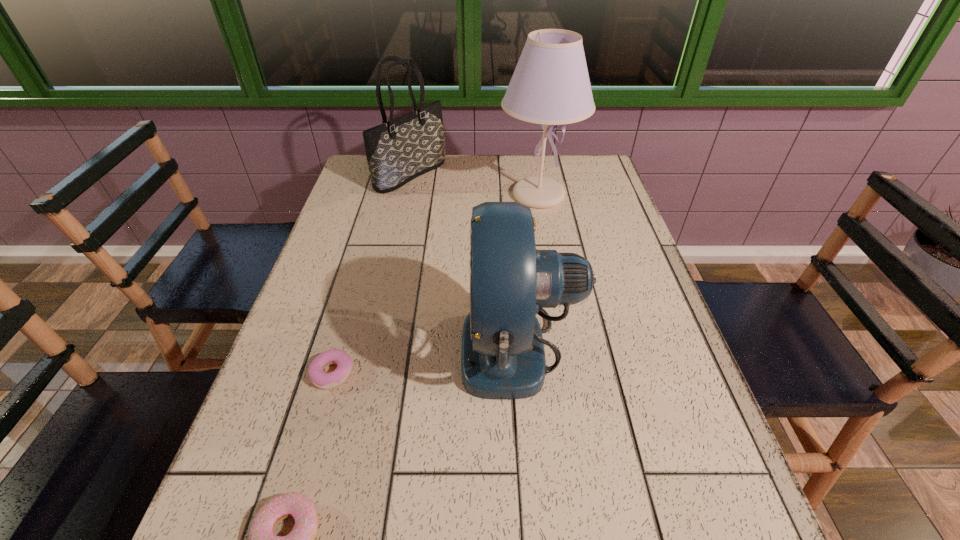
The image size is (960, 540). In order to click on the tallest object in this screenshot , I will do `click(550, 86)`.

The image size is (960, 540). Identify the location of tote bag. (399, 150).

Locate an element on the screen. This screenshot has width=960, height=540. fan is located at coordinates (502, 353).

Identify the location of pastry. The width and height of the screenshot is (960, 540). coord(321,379).

Find the location of a particular element. Image resolution: width=960 pixels, height=540 pixels. vacant space located on the left of the lampshade is located at coordinates (429, 195).

The image size is (960, 540). I want to click on vacant area situated on the right of the tote bag, so click(483, 176).

Locate an element on the screen. Image resolution: width=960 pixels, height=540 pixels. free space located in front of the fan to blow air is located at coordinates click(375, 346).

The width and height of the screenshot is (960, 540). I want to click on free space located in front of the fan to blow air, so click(x=357, y=346).

Locate an element on the screen. This screenshot has width=960, height=540. free space located 0.290m in front of the fan to blow air is located at coordinates (329, 346).

I want to click on free location located on the right of the shortest object, so click(401, 373).